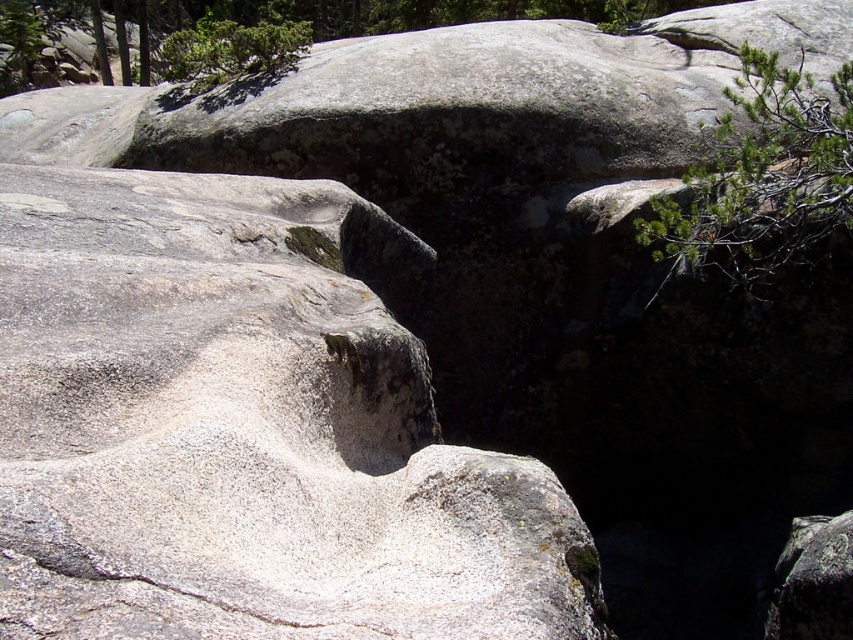
Question: Can you confirm if green needle-like plant at upper right is positioned below green leafy shrub at upper center?

Choices:
 (A) yes
 (B) no

Answer: (A)

Question: Does green needle-like plant at upper right come behind green leafy shrub at upper center?

Choices:
 (A) no
 (B) yes

Answer: (A)

Question: Which point is closer to the camera?

Choices:
 (A) (260, 28)
 (B) (764, 179)

Answer: (B)

Question: Which object is closer to the camera taking this photo?

Choices:
 (A) green needle-like plant at upper right
 (B) green leafy shrub at upper center

Answer: (A)

Question: Can you confirm if green needle-like plant at upper right is positioned below green leafy shrub at upper center?

Choices:
 (A) yes
 (B) no

Answer: (A)

Question: Which point is closer to the camera?

Choices:
 (A) (686, 250)
 (B) (187, 67)

Answer: (A)